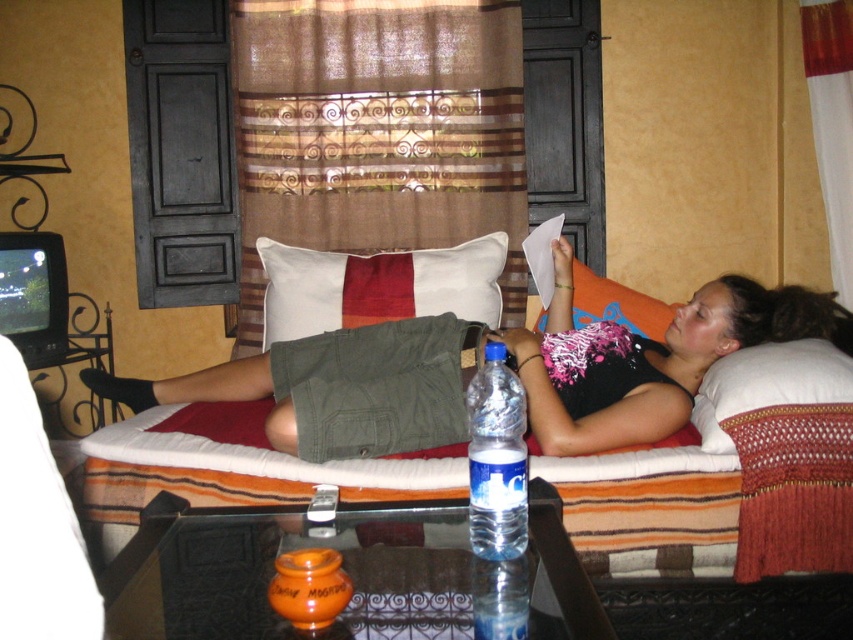
Is white cotton pillow at center bigger than clear plastic bottle at center?

Correct, white cotton pillow at center is larger in size than clear plastic bottle at center.

Between white cotton pillow at center and clear plastic bottle at center, which one appears on the left side from the viewer's perspective?

From the viewer's perspective, white cotton pillow at center appears more on the left side.

Between point (311, 332) and point (486, 515), which one is positioned in front?

Point (486, 515) is in front.

I want to click on white cotton pillow at center, so click(376, 285).

Is clear plastic bottle at center closer to camera compared to orange fabric pillow at upper right?

Yes.

Between clear plastic bottle at center and orange fabric pillow at upper right, which one has more height?

Standing taller between the two is clear plastic bottle at center.

I want to click on clear plastic bottle at center, so click(496, 460).

At what (x,y) coordinates should I click in order to perform the action: click on clear plastic bottle at center. Please return your answer as a coordinate pair (x, y). Looking at the image, I should click on (496, 460).

Is white cotton pillow at center closer to the viewer compared to crocheted white pillow at right?

No, it is not.

Which is more to the left, white cotton pillow at center or crocheted white pillow at right?

white cotton pillow at center is more to the left.

Between point (448, 276) and point (799, 364), which one is positioned behind?

Point (448, 276)

You are a GUI agent. You are given a task and a screenshot of the screen. Output one action in this format:
    pyautogui.click(x=<x>, y=<y>)
    Task: Click on the white cotton pillow at center
    This screenshot has width=853, height=640.
    Given the screenshot: What is the action you would take?
    pyautogui.click(x=376, y=285)